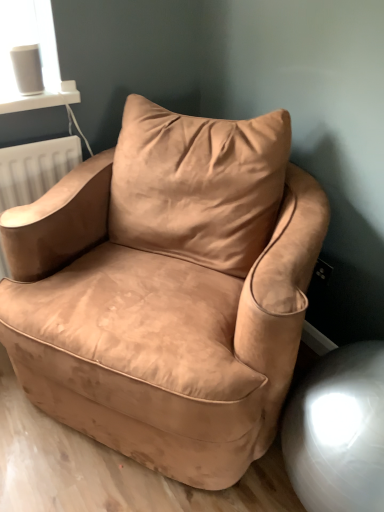
What is the approximate height of suede-like beige armchair at center?

suede-like beige armchair at center is 88.85 centimeters tall.

This screenshot has height=512, width=384. Identify the location of suede-like beige armchair at center. (167, 290).

What do you see at coordinates (167, 290) in the screenshot? I see `suede-like beige armchair at center` at bounding box center [167, 290].

Measure the distance between point (342, 483) and camera.

Point (342, 483) and camera are 36.46 inches apart.

You are a GUI agent. You are given a task and a screenshot of the screen. Output one action in this format:
    pyautogui.click(x=<x>, y=<y>)
    Task: Click on the suede tan swivel chair at lower right
    The width and height of the screenshot is (384, 512).
    Given the screenshot: What is the action you would take?
    pyautogui.click(x=338, y=431)

What do you see at coordinates (338, 431) in the screenshot? I see `suede tan swivel chair at lower right` at bounding box center [338, 431].

Where is `suede-like beige armchair at center`? suede-like beige armchair at center is located at coordinates (167, 290).

Which is more to the right, suede-like beige armchair at center or suede tan swivel chair at lower right?

From the viewer's perspective, suede tan swivel chair at lower right appears more on the right side.

Does suede-like beige armchair at center come in front of suede tan swivel chair at lower right?

Yes, it is in front of suede tan swivel chair at lower right.

Between point (36, 368) and point (326, 434), which one is positioned in front?

The point (326, 434) is more forward.

From the image's perspective, relative to suede tan swivel chair at lower right, is suede-like beige armchair at center above or below?

Based on their image positions, suede-like beige armchair at center is located above suede tan swivel chair at lower right.

Consider the image. From a real-world perspective, between suede-like beige armchair at center and suede tan swivel chair at lower right, who is vertically higher?

suede-like beige armchair at center is physically above.

From the picture: Is suede-like beige armchair at center wider than suede tan swivel chair at lower right?

Indeed, suede-like beige armchair at center has a greater width compared to suede tan swivel chair at lower right.

Considering the sizes of objects suede-like beige armchair at center and suede tan swivel chair at lower right in the image provided, who is taller, suede-like beige armchair at center or suede tan swivel chair at lower right?

Standing taller between the two is suede-like beige armchair at center.

Between suede-like beige armchair at center and suede tan swivel chair at lower right, which one has larger size?

suede-like beige armchair at center is bigger.

Consider the image. Is suede-like beige armchair at center spatially inside suede tan swivel chair at lower right, or outside of it?

The correct answer is: outside.

Is suede-like beige armchair at center in contact with suede tan swivel chair at lower right?

suede-like beige armchair at center is not next to suede tan swivel chair at lower right, and they're not touching.

Does suede-like beige armchair at center turn towards suede tan swivel chair at lower right?

No, suede-like beige armchair at center does not turn towards suede tan swivel chair at lower right.

How far apart are suede-like beige armchair at center and suede tan swivel chair at lower right?

suede-like beige armchair at center and suede tan swivel chair at lower right are 39.87 centimeters apart.

This screenshot has height=512, width=384. I want to click on swivel chair below the suede-like beige armchair at center (from a real-world perspective), so click(x=338, y=431).

Based on the photo, considering the relative positions of suede tan swivel chair at lower right and suede-like beige armchair at center in the image provided, is suede tan swivel chair at lower right to the left or to the right of suede-like beige armchair at center?

Clearly, suede tan swivel chair at lower right is on the right of suede-like beige armchair at center in the image.

From the picture: Who is more distant, suede tan swivel chair at lower right or suede-like beige armchair at center?

suede tan swivel chair at lower right is further from the camera.

Between point (317, 478) and point (256, 370), which one is positioned behind?

The point (256, 370) is more distant.

In the scene shown: From the image's perspective, who appears lower, suede tan swivel chair at lower right or suede-like beige armchair at center?

From the image's view, suede tan swivel chair at lower right is below.

From a real-world perspective, which object stands above the other?

suede-like beige armchair at center.

Considering the sizes of objects suede tan swivel chair at lower right and suede-like beige armchair at center in the image provided, who is wider, suede tan swivel chair at lower right or suede-like beige armchair at center?

suede-like beige armchair at center.

Does suede tan swivel chair at lower right have a lesser height compared to suede-like beige armchair at center?

Yes, suede tan swivel chair at lower right is shorter than suede-like beige armchair at center.

Considering the relative sizes of suede tan swivel chair at lower right and suede-like beige armchair at center in the image provided, is suede tan swivel chair at lower right bigger than suede-like beige armchair at center?

No.

Can we say suede tan swivel chair at lower right lies outside suede-like beige armchair at center?

Yes, suede tan swivel chair at lower right is outside of suede-like beige armchair at center.

Are suede tan swivel chair at lower right and suede-like beige armchair at center far apart?

No, suede tan swivel chair at lower right is not far away from suede-like beige armchair at center.

Is suede tan swivel chair at lower right facing away from suede-like beige armchair at center?

No, suede tan swivel chair at lower right is not facing the opposite direction of suede-like beige armchair at center.

How distant is suede tan swivel chair at lower right from suede-like beige armchair at center?

A distance of 39.87 centimeters exists between suede tan swivel chair at lower right and suede-like beige armchair at center.

The image size is (384, 512). I want to click on swivel chair that is under the suede-like beige armchair at center (from a real-world perspective), so [x=338, y=431].

The height and width of the screenshot is (512, 384). I want to click on chair above the suede tan swivel chair at lower right (from the image's perspective), so click(x=167, y=290).

You are a GUI agent. You are given a task and a screenshot of the screen. Output one action in this format:
    pyautogui.click(x=<x>, y=<y>)
    Task: Click on the swivel chair behind the suede-like beige armchair at center
    This screenshot has height=512, width=384.
    Given the screenshot: What is the action you would take?
    pyautogui.click(x=338, y=431)